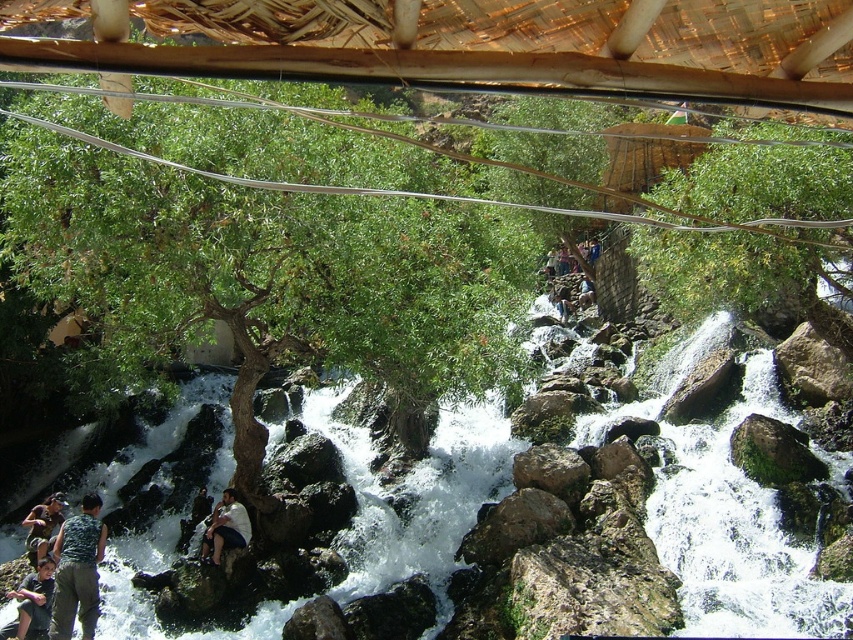
Question: Which point is farther to the camera?

Choices:
 (A) (33, 636)
 (B) (785, 300)
 (C) (32, 529)
 (D) (68, 556)

Answer: (B)

Question: Can you confirm if green leafy tree at center is positioned to the right of dark green fabric shirt at lower left?

Choices:
 (A) no
 (B) yes

Answer: (B)

Question: Which object appears closest to the camera in this image?

Choices:
 (A) green leafy tree at center
 (B) green leafy tree at upper center

Answer: (A)

Question: Does green leafy tree at center come behind white cotton shirt at lower center?

Choices:
 (A) yes
 (B) no

Answer: (B)

Question: Which point is farther to the camera?

Choices:
 (A) (218, 520)
 (B) (94, 570)
 (C) (671, 241)
 (D) (469, 356)

Answer: (C)

Question: Does dark green fabric shirt at lower left have a larger size compared to camouflage fabric person at lower left?

Choices:
 (A) no
 (B) yes

Answer: (A)